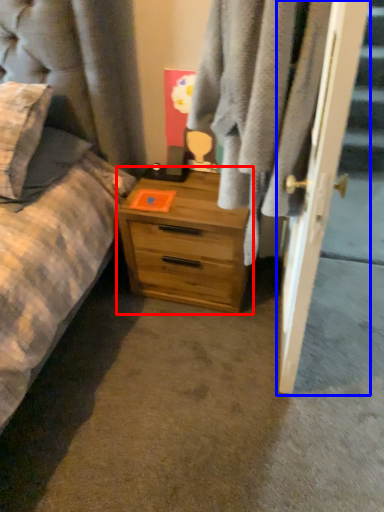
Question: Which point is closer to the camera, chest of drawers (highlighted by a red box) or door (highlighted by a blue box)?

Choices:
 (A) chest of drawers
 (B) door

Answer: (B)